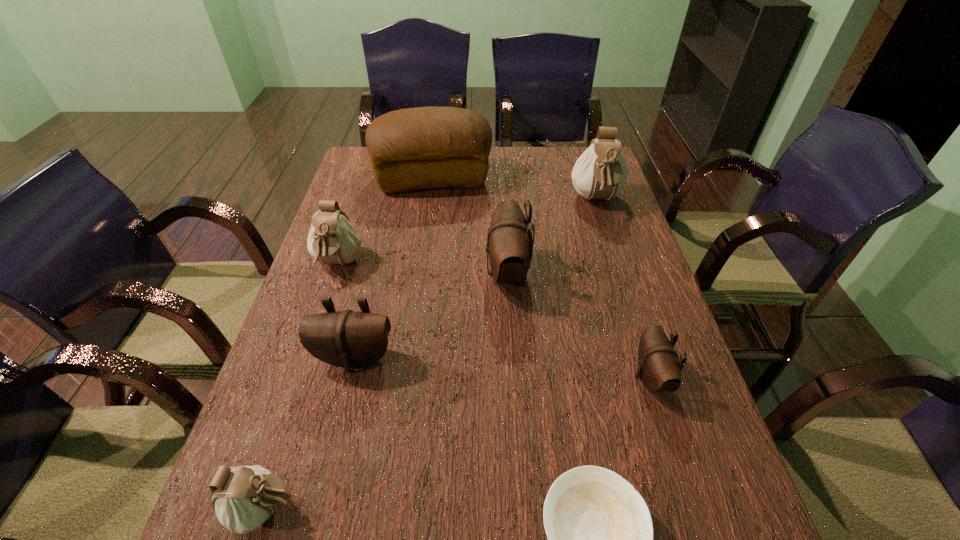
Identify the location of bread. (429, 147).

This screenshot has height=540, width=960. I want to click on the farthest pouch, so click(600, 172).

Where is `the farthest white pouch`? the farthest white pouch is located at coordinates (600, 172).

Identify the location of the farthest brown pouch. This screenshot has height=540, width=960. (509, 245).

Find the location of a particular element. The image size is (960, 540). the second brown pouch from left to right is located at coordinates (509, 245).

The width and height of the screenshot is (960, 540). In order to click on the second biggest white pouch in this screenshot , I will do `click(332, 239)`.

Find the location of a particular element. Image resolution: width=960 pixels, height=540 pixels. the second smallest brown pouch is located at coordinates (348, 339).

Locate an element on the screen. the rightmost brown pouch is located at coordinates (658, 366).

Locate an element on the screen. The image size is (960, 540). vacant space located on the front of the bread is located at coordinates (428, 215).

I want to click on vacant region located 0.320m on the front-facing side of the biggest white pouch, so click(627, 297).